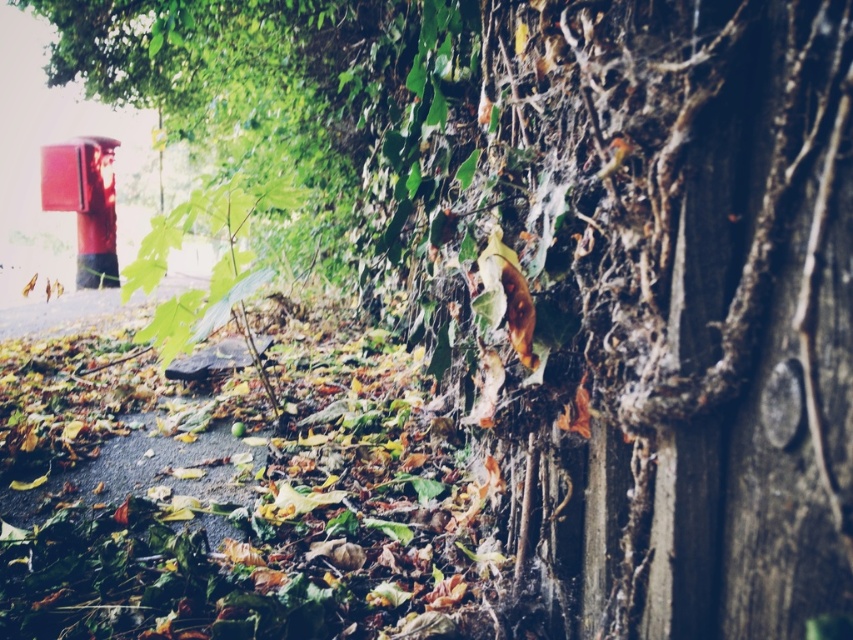
Question: Is dark brown wood at center thinner than metallic red fire hydrant at upper left?

Choices:
 (A) no
 (B) yes

Answer: (B)

Question: Which point appears farthest from the camera in this image?

Choices:
 (A) pyautogui.click(x=648, y=636)
 (B) pyautogui.click(x=108, y=248)

Answer: (B)

Question: Which object appears closest to the camera in this image?

Choices:
 (A) metallic red fire hydrant at upper left
 (B) dark brown wood at center

Answer: (B)

Question: Does dark brown wood at center have a greater width compared to metallic red fire hydrant at upper left?

Choices:
 (A) no
 (B) yes

Answer: (A)

Question: Does dark brown wood at center have a lesser width compared to metallic red fire hydrant at upper left?

Choices:
 (A) no
 (B) yes

Answer: (B)

Question: Which point is farther to the camera?

Choices:
 (A) metallic red fire hydrant at upper left
 (B) dark brown wood at center

Answer: (A)